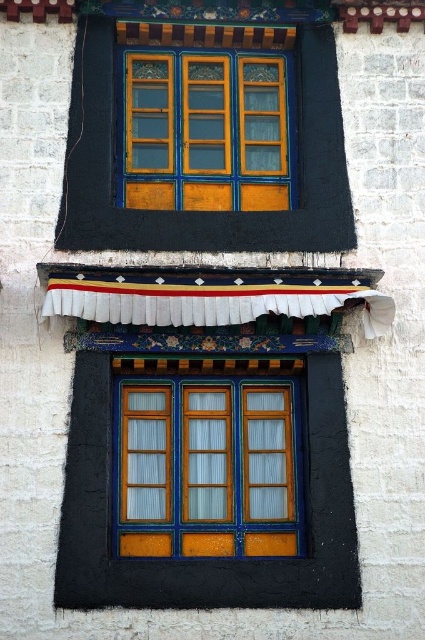
Which is more to the right, wooden shutter at center or wooden at center?

wooden at center is more to the right.

Between wooden shutter at center and wooden at center, which one appears on the left side from the viewer's perspective?

From the viewer's perspective, wooden shutter at center appears more on the left side.

Does point (138, 412) come behind point (280, 452)?

No, it is not.

At what (x,y) coordinates should I click in order to perform the action: click on wooden shutter at center. Please return your answer as a coordinate pair (x, y). This screenshot has width=425, height=640. Looking at the image, I should click on (146, 452).

Does point (136, 500) come closer to viewer compared to point (215, 433)?

Yes, it is.

The width and height of the screenshot is (425, 640). What are the coordinates of `wooden shutter at center` in the screenshot? It's located at (146, 452).

Looking at this image, does matte wood window frame at center appear on the right side of wooden shutter at center?

Indeed, matte wood window frame at center is positioned on the right side of wooden shutter at center.

Is matte wood window frame at center bigger than wooden shutter at center?

Correct, matte wood window frame at center is larger in size than wooden shutter at center.

Between point (189, 461) and point (132, 454), which one is positioned behind?

Positioned behind is point (189, 461).

Image resolution: width=425 pixels, height=640 pixels. In order to click on matte wood window frame at center in this screenshot , I will do `click(207, 467)`.